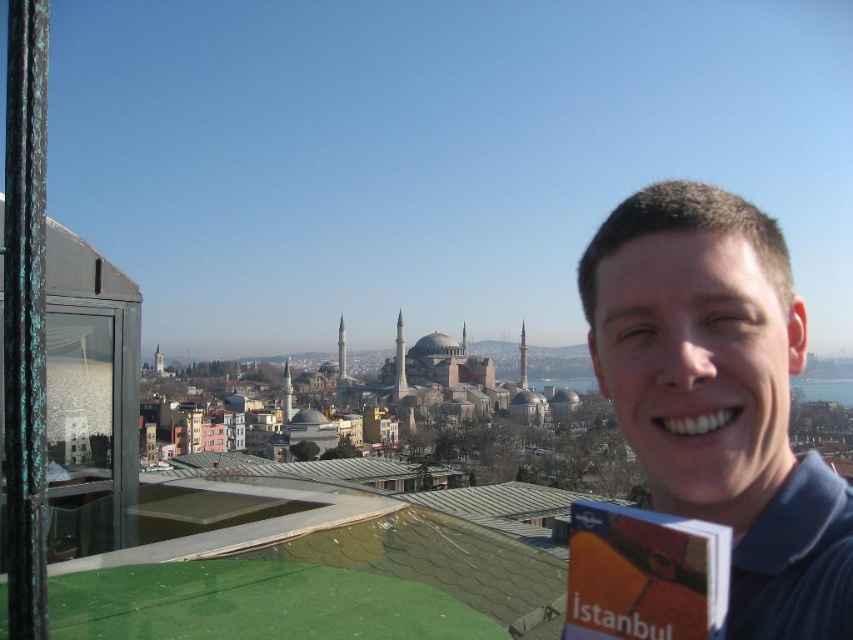
In the image, there is a person holding a book titled Istanbul and a blue shirt at right. Which object is closer to the point located at coordinates [720,396]?

The blue shirt at right is located at point [720,396], so it is exactly at that coordinate.

You are a photographer trying to capture a photo of both the blue shirt at right and the orange paper book at right. Which object should you zoom in on to ensure both are clearly visible in the frame?

The blue shirt at right is smaller than the orange paper book at right, so you should zoom in on the blue shirt at right to ensure both are clearly visible in the frame.